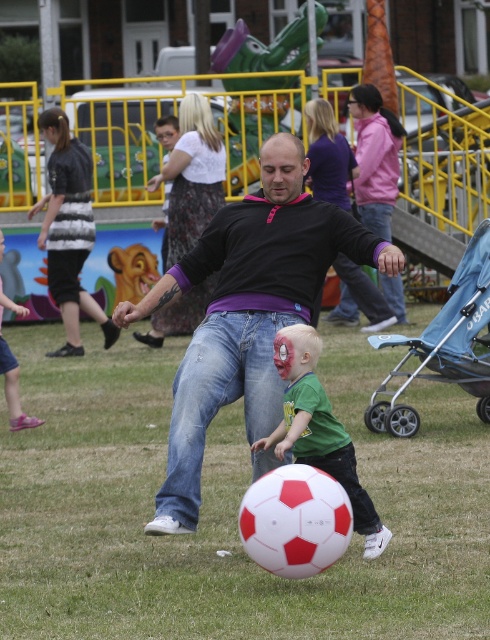
Question: Is green matte shirt at center smaller than striped fabric shirt at left?

Choices:
 (A) no
 (B) yes

Answer: (B)

Question: Among these objects, which one is nearest to the camera?

Choices:
 (A) pink fabric pants at lower left
 (B) matte black shirt at center
 (C) striped fabric shirt at left

Answer: (B)

Question: Can you confirm if blue fabric stroller at center-right is positioned to the left of striped fabric shirt at left?

Choices:
 (A) yes
 (B) no

Answer: (B)

Question: Which point is farther from the camera taking this photo?

Choices:
 (A) (392, 336)
 (B) (3, 244)

Answer: (B)

Question: Does matte black shirt at center have a lesser width compared to green matte shirt at center?

Choices:
 (A) no
 (B) yes

Answer: (A)

Question: Which object is the farthest from the pink fabric pants at lower left?

Choices:
 (A) matte black shirt at center
 (B) green matte shirt at center
 (C) blue fabric stroller at center-right

Answer: (B)